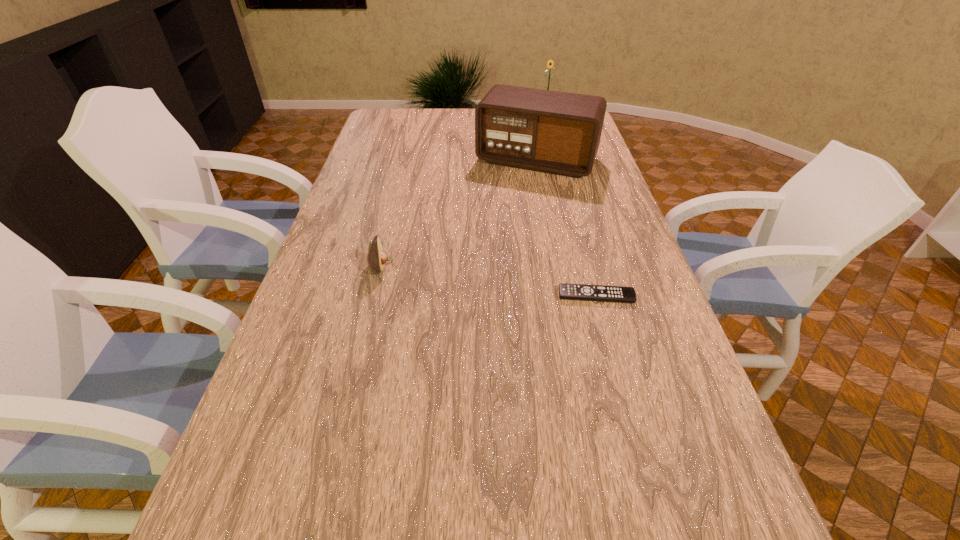
The width and height of the screenshot is (960, 540). I want to click on vacant area that lies between the third farthest object and the shortest object, so click(489, 281).

At what (x,y) coordinates should I click in order to perform the action: click on free spot between the sunflower and the nearest object. Please return your answer as a coordinate pair (x, y). The width and height of the screenshot is (960, 540). Looking at the image, I should click on (571, 206).

This screenshot has height=540, width=960. In order to click on free space between the radio receiver and the third farthest object in this screenshot , I will do `click(459, 213)`.

Locate an element on the screen. This screenshot has width=960, height=540. free space between the second nearest object and the remote control is located at coordinates (489, 281).

Identify which object is located as the nearest to the second nearest object. Please provide its 2D coordinates. Your answer should be formatted as a tuple, i.e. [(x, y)], where the tuple contains the x and y coordinates of a point satisfying the conditions above.

[(554, 132)]

What are the coordinates of `object that ranks as the second closest to the avocado` in the screenshot? It's located at (566, 291).

Find the location of a particular element. The image size is (960, 540). free space that satisfies the following two spatial constraints: 1. on the front side of the radio receiver; 2. on the left side of the nearest object is located at coordinates click(x=563, y=296).

Where is `free spot that satisfies the following two spatial constraints: 1. on the front side of the nearest object; 2. on the right side of the third nearest object`? The image size is (960, 540). free spot that satisfies the following two spatial constraints: 1. on the front side of the nearest object; 2. on the right side of the third nearest object is located at coordinates (563, 296).